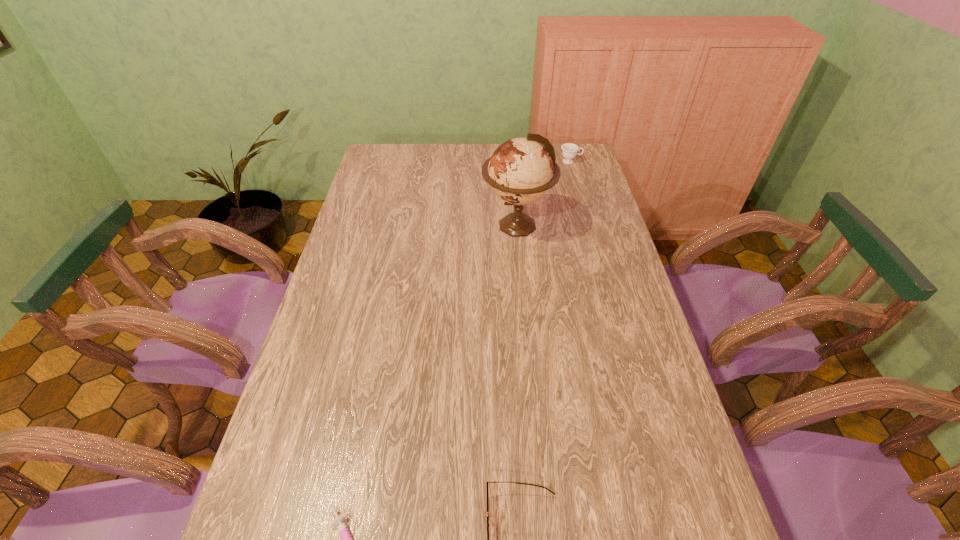
At what (x,y) coordinates should I click in order to perform the action: click on vacant space at the far edge. Please return your answer as a coordinate pair (x, y). Looking at the image, I should click on (459, 152).

Locate an element on the screen. free space at the left edge of the desktop is located at coordinates (323, 323).

In the image, there is a desktop. Identify the location of vacant area at the right edge. (559, 192).

At what (x,y) coordinates should I click in order to perform the action: click on free space at the far left corner of the desktop. Please return your answer as a coordinate pair (x, y). Looking at the image, I should click on (380, 162).

This screenshot has height=540, width=960. In the image, there is a desktop. Find the location of `free region at the far right corner`. free region at the far right corner is located at coordinates (565, 169).

Select which object is the second closest to the second shortest object. Please provide its 2D coordinates. Your answer should be formatted as a tuple, i.e. [(x, y)], where the tuple contains the x and y coordinates of a point satisfying the conditions above.

[(520, 171)]

In order to click on object that can be found as the third closest to the shortest object in this screenshot , I will do [x=569, y=150].